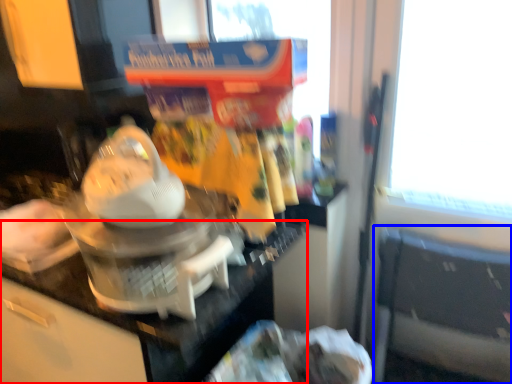
Question: Which object is further to the camera taking this photo, counter top (highlighted by a red box) or chair (highlighted by a blue box)?

Choices:
 (A) counter top
 (B) chair

Answer: (B)